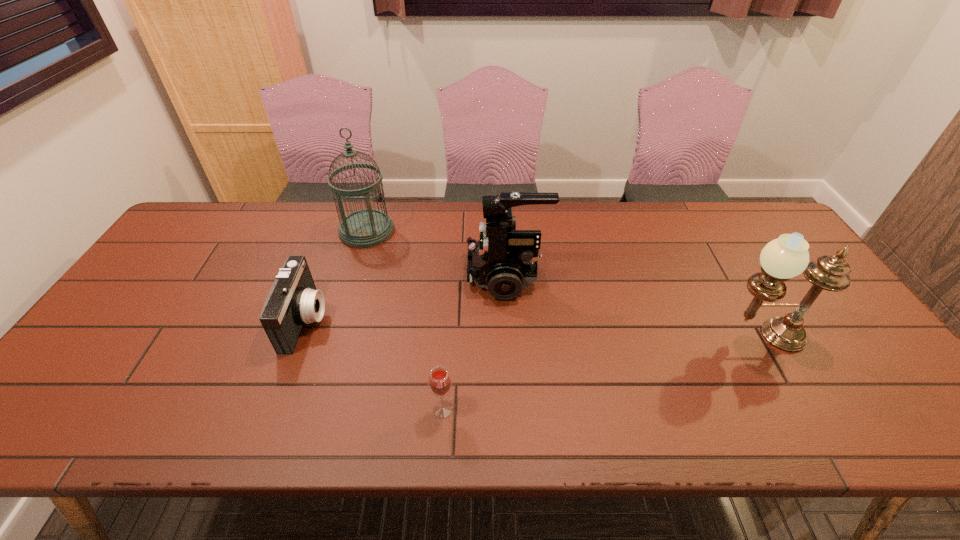
Find the location of a particular element. This screenshot has width=960, height=540. birdcage is located at coordinates click(x=364, y=228).

This screenshot has height=540, width=960. What are the coordinates of `the rightmost object` in the screenshot? It's located at (787, 256).

The width and height of the screenshot is (960, 540). What are the coordinates of `the third tallest object` in the screenshot? It's located at (504, 261).

Find the location of a particular element. the right camcorder is located at coordinates (504, 261).

Image resolution: width=960 pixels, height=540 pixels. Find the location of `the left camcorder`. the left camcorder is located at coordinates (293, 299).

The height and width of the screenshot is (540, 960). I want to click on wineglass, so click(440, 382).

The image size is (960, 540). In order to click on the nearest object in this screenshot , I will do `click(440, 382)`.

I want to click on vacant space located on the front-facing side of the birdcage, so click(347, 298).

This screenshot has width=960, height=540. I want to click on free region located on the left of the oil lamp, so click(x=652, y=336).

The image size is (960, 540). I want to click on vacant area located on the lens mount of the third shortest object, so click(342, 276).